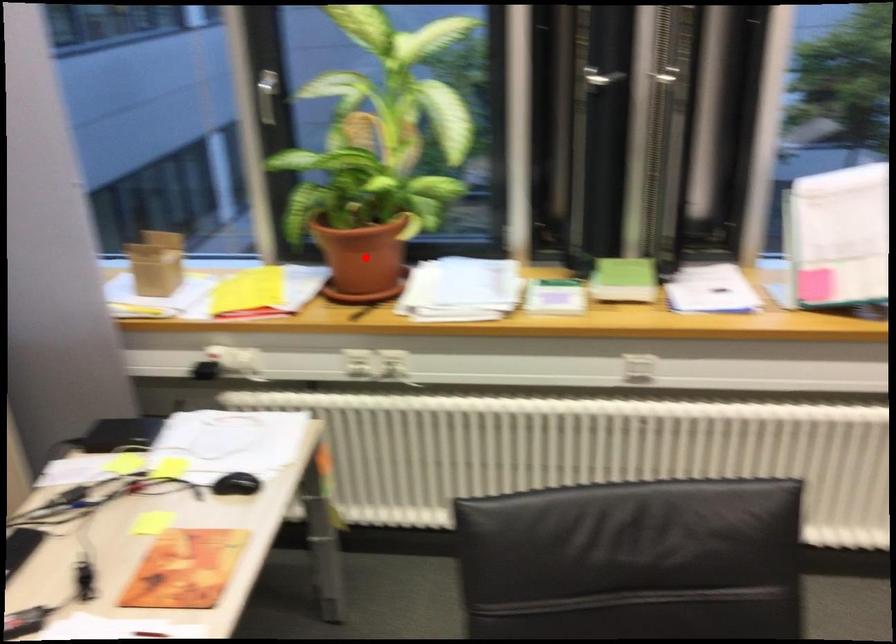
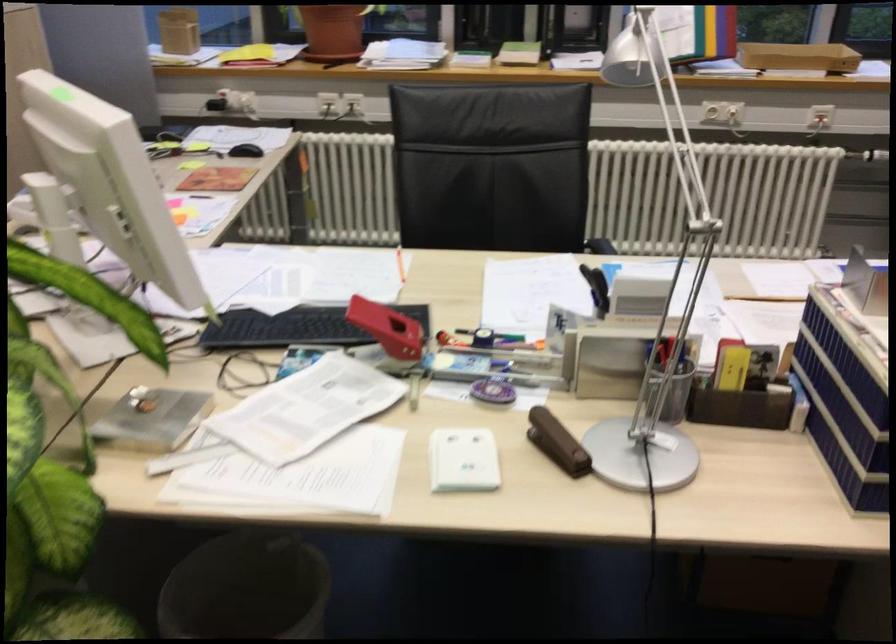
Find the pixel in the second image that matches the highlighted location in the first image.

(332, 31)